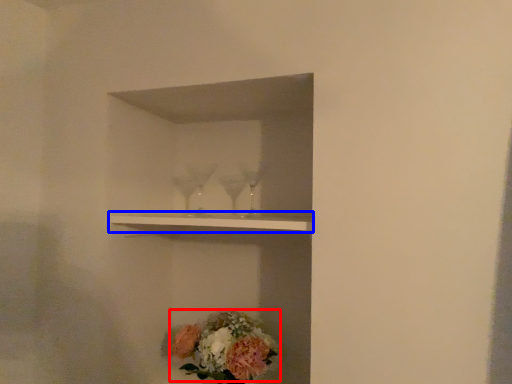
Question: Which object appears farthest to the camera in this image, flower (highlighted by a red box) or shelf (highlighted by a blue box)?

Choices:
 (A) flower
 (B) shelf

Answer: (A)